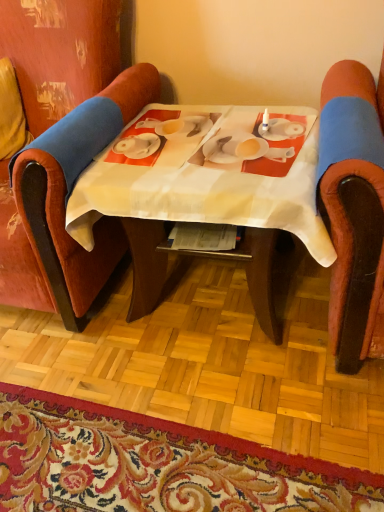
Question: From a real-world perspective, is carpet with floral pattern at lower center physically above velvet red chair at left, acting as the second chair starting from the right?

Choices:
 (A) no
 (B) yes

Answer: (A)

Question: Is carpet with floral pattern at lower center at the left side of velvet red chair at left, which is the first chair in left-to-right order?

Choices:
 (A) no
 (B) yes

Answer: (A)

Question: Is velvet red chair at left, which is the first chair in left-to-right order, inside carpet with floral pattern at lower center?

Choices:
 (A) yes
 (B) no

Answer: (B)

Question: From the image's perspective, does carpet with floral pattern at lower center appear higher than velvet red chair at left, which is the first chair in left-to-right order?

Choices:
 (A) yes
 (B) no

Answer: (B)

Question: Can you confirm if carpet with floral pattern at lower center is shorter than velvet red chair at left, acting as the second chair starting from the right?

Choices:
 (A) no
 (B) yes

Answer: (B)

Question: Is point (337, 335) closer or farther from the camera than point (192, 472)?

Choices:
 (A) farther
 (B) closer

Answer: (A)

Question: In the image, is velvet-like orange chair at right, which is the first chair in right-to-left order, on the left side or the right side of carpet with floral pattern at lower center?

Choices:
 (A) right
 (B) left

Answer: (A)

Question: From the image's perspective, is velvet-like orange chair at right, which is the first chair in right-to-left order, located above or below carpet with floral pattern at lower center?

Choices:
 (A) below
 (B) above

Answer: (B)

Question: Based on their sizes in the image, would you say velvet-like orange chair at right, the second chair viewed from the left, is bigger or smaller than carpet with floral pattern at lower center?

Choices:
 (A) big
 (B) small

Answer: (A)

Question: Considering the positions of point (173, 159) and point (125, 104), is point (173, 159) closer or farther from the camera than point (125, 104)?

Choices:
 (A) closer
 (B) farther

Answer: (A)

Question: Is white fabric table at center inside or outside of velvet red chair at left, acting as the second chair starting from the right?

Choices:
 (A) inside
 (B) outside

Answer: (B)

Question: From a real-world perspective, is white fabric table at center positioned above or below velvet red chair at left, acting as the second chair starting from the right?

Choices:
 (A) below
 (B) above

Answer: (A)

Question: Is white fabric table at center taller or shorter than velvet red chair at left, which is the first chair in left-to-right order?

Choices:
 (A) short
 (B) tall

Answer: (A)

Question: Considering the positions of velvet red chair at left, which is the first chair in left-to-right order, and white fabric table at center in the image, is velvet red chair at left, which is the first chair in left-to-right order, wider or thinner than white fabric table at center?

Choices:
 (A) wide
 (B) thin

Answer: (A)

Question: From their relative heights in the image, would you say velvet red chair at left, which is the first chair in left-to-right order, is taller or shorter than white fabric table at center?

Choices:
 (A) tall
 (B) short

Answer: (A)